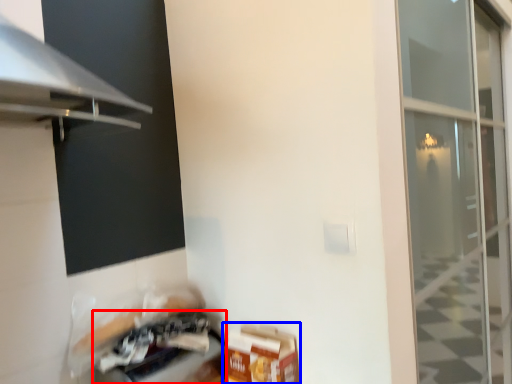
Question: Which point is closer to the camera, appliance (highlighted by a red box) or cardboard box (highlighted by a blue box)?

Choices:
 (A) appliance
 (B) cardboard box

Answer: (A)